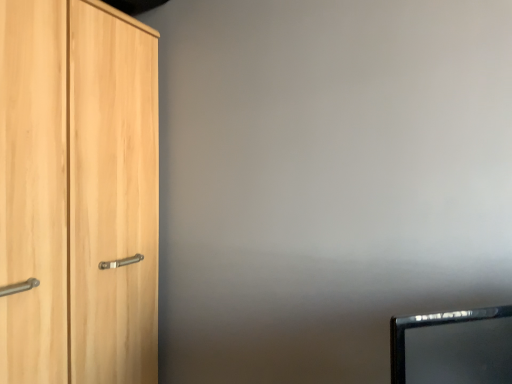
Question: Is light wood cupboard at left not close to black glossy monitor at lower right?

Choices:
 (A) yes
 (B) no

Answer: (B)

Question: Is light wood cupboard at left positioned beyond the bounds of black glossy monitor at lower right?

Choices:
 (A) yes
 (B) no

Answer: (A)

Question: From the image's perspective, is light wood cupboard at left located above black glossy monitor at lower right?

Choices:
 (A) no
 (B) yes

Answer: (B)

Question: Is light wood cupboard at left positioned before black glossy monitor at lower right?

Choices:
 (A) yes
 (B) no

Answer: (B)

Question: From the image's perspective, is light wood cupboard at left under black glossy monitor at lower right?

Choices:
 (A) yes
 (B) no

Answer: (B)

Question: Considering the relative sizes of light wood cupboard at left and black glossy monitor at lower right in the image provided, is light wood cupboard at left smaller than black glossy monitor at lower right?

Choices:
 (A) yes
 (B) no

Answer: (B)

Question: Considering the relative sizes of black glossy monitor at lower right and light wood cupboard at left in the image provided, is black glossy monitor at lower right bigger than light wood cupboard at left?

Choices:
 (A) yes
 (B) no

Answer: (B)

Question: Does black glossy monitor at lower right have a greater width compared to light wood cupboard at left?

Choices:
 (A) yes
 (B) no

Answer: (B)

Question: From the image's perspective, would you say black glossy monitor at lower right is positioned over light wood cupboard at left?

Choices:
 (A) no
 (B) yes

Answer: (A)

Question: Can light wood cupboard at left be found inside black glossy monitor at lower right?

Choices:
 (A) no
 (B) yes

Answer: (A)

Question: Can you confirm if black glossy monitor at lower right is positioned to the left of light wood cupboard at left?

Choices:
 (A) yes
 (B) no

Answer: (B)

Question: From the image's perspective, is black glossy monitor at lower right below light wood cupboard at left?

Choices:
 (A) no
 (B) yes

Answer: (B)

Question: From a real-world perspective, is light wood cupboard at left above or below black glossy monitor at lower right?

Choices:
 (A) above
 (B) below

Answer: (A)